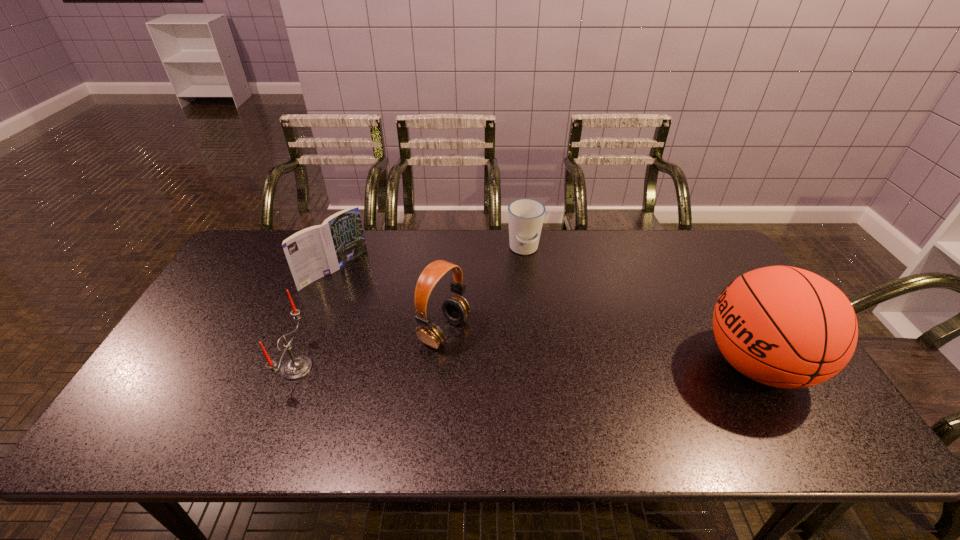
At what (x,y) coordinates should I click in order to perform the action: click on free spot on the desktop that is between the candle and the basketball and is positioned with a handle on the side of the second object from right to left. Please return your answer as a coordinate pair (x, y). Looking at the image, I should click on (527, 366).

Find the location of a particular element. This screenshot has width=960, height=540. free space on the desktop that is between the candle and the rightmost object and is positioned on the ear cups of the third object from left to right is located at coordinates (513, 366).

At what (x,y) coordinates should I click in order to perform the action: click on vacant spot on the desktop that is between the candle and the tallest object and is positioned on the front cover of the book. Please return your answer as a coordinate pair (x, y). Looking at the image, I should click on (466, 367).